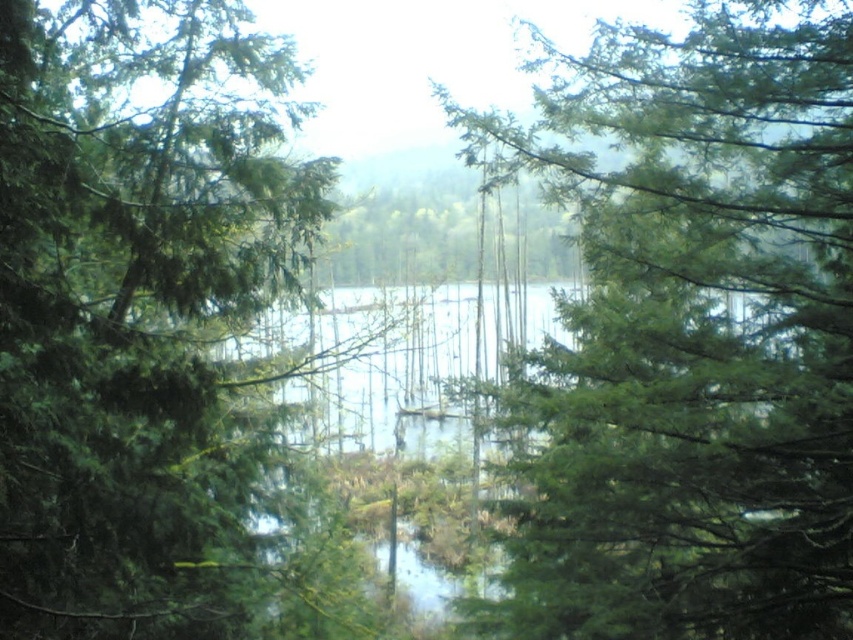
Question: Can you confirm if green leafy tree at center is wider than green matte tree at left?

Choices:
 (A) no
 (B) yes

Answer: (B)

Question: In this image, where is green leafy tree at center located relative to green matte tree at left?

Choices:
 (A) right
 (B) left

Answer: (A)

Question: Does green leafy tree at center have a greater width compared to green matte tree at left?

Choices:
 (A) no
 (B) yes

Answer: (B)

Question: Among these objects, which one is nearest to the camera?

Choices:
 (A) green leafy tree at center
 (B) green matte tree at left

Answer: (A)